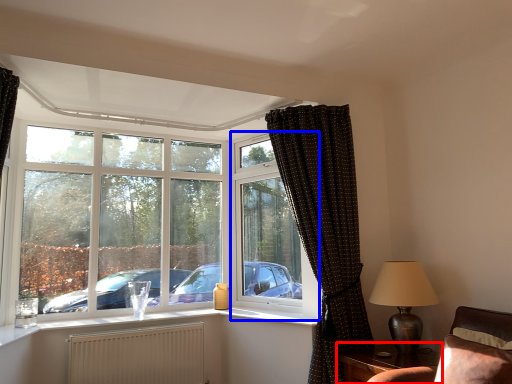
Question: Which of the following is the closest to the observer, table (highlighted by a red box) or window frame (highlighted by a blue box)?

Choices:
 (A) table
 (B) window frame

Answer: (A)